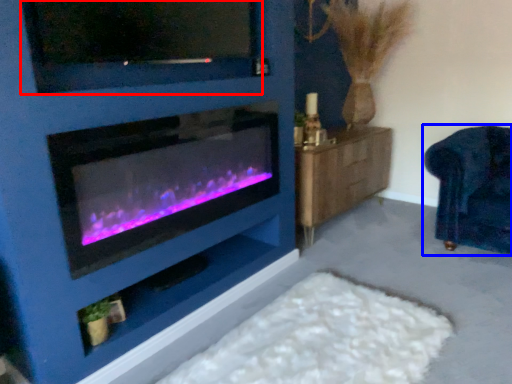
Question: Which of the following is the farthest to the observer, tv show (highlighted by a red box) or furniture (highlighted by a blue box)?

Choices:
 (A) tv show
 (B) furniture

Answer: (B)